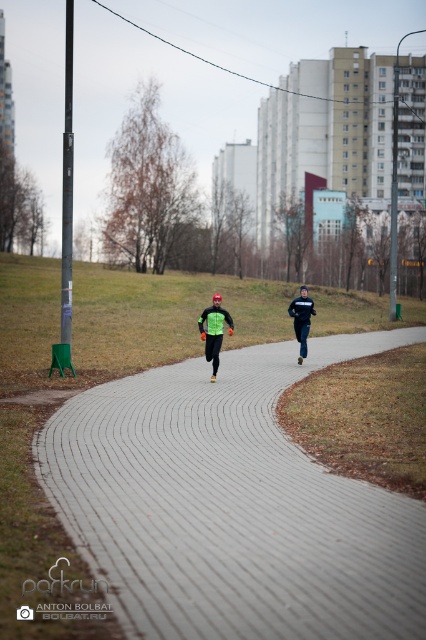
Question: Considering the real-world distances, which object is farthest from the black matte running suit at center?

Choices:
 (A) neon green fabric at center
 (B) gray brick pavement at center

Answer: (B)

Question: Is gray brick pavement at center wider than black matte running suit at center?

Choices:
 (A) yes
 (B) no

Answer: (A)

Question: Does gray brick pavement at center have a larger size compared to black matte running suit at center?

Choices:
 (A) yes
 (B) no

Answer: (A)

Question: Which point is closer to the camera?

Choices:
 (A) black matte running suit at center
 (B) gray brick pavement at center

Answer: (B)

Question: Which point is farther to the camera?

Choices:
 (A) (215, 349)
 (B) (296, 304)

Answer: (B)

Question: Is neon green fabric at center wider than black matte running suit at center?

Choices:
 (A) no
 (B) yes

Answer: (A)